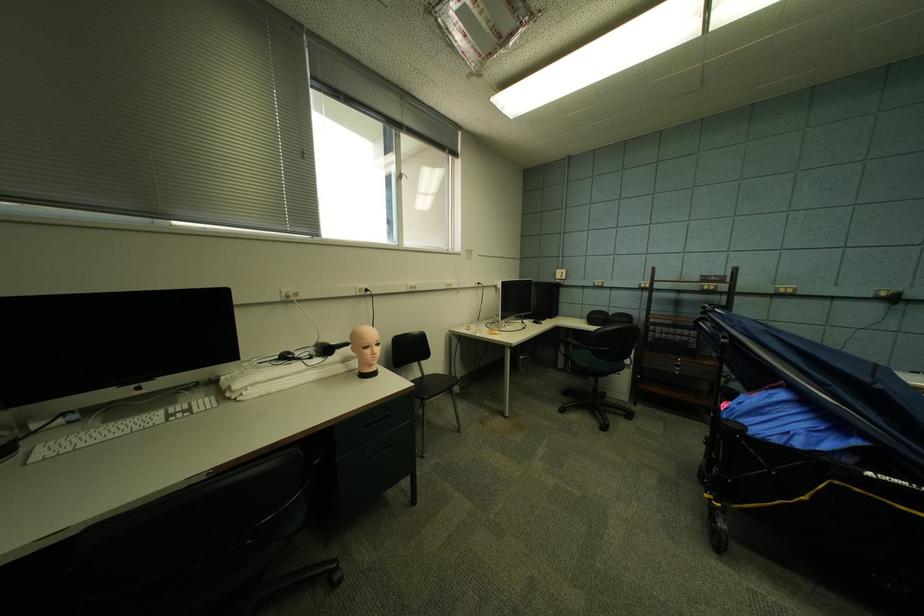
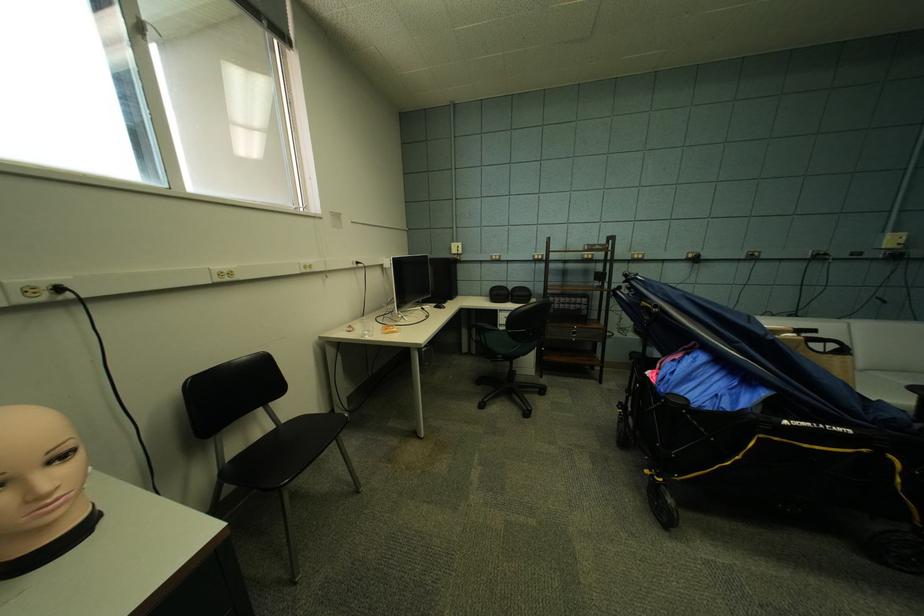
Where in the second image is the point corresponding to point 409,182 from the first image?

(154, 42)